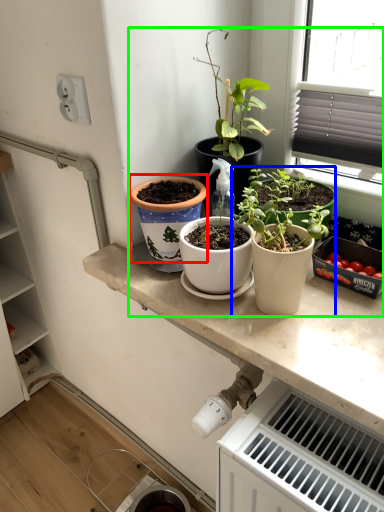
Question: Which is nearer to the flowerpot (highlighted by a red box)? houseplant (highlighted by a blue box) or vegetable garden (highlighted by a green box).

Choices:
 (A) houseplant
 (B) vegetable garden

Answer: (A)